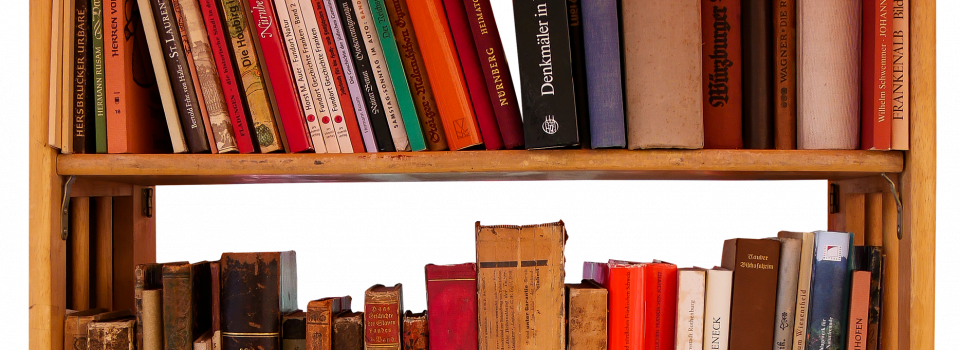
Locate an element on the screen. This screenshot has height=350, width=960. books with red spines is located at coordinates (228, 78), (281, 103), (349, 110), (477, 105), (498, 82), (715, 98), (644, 292), (453, 300), (880, 97).